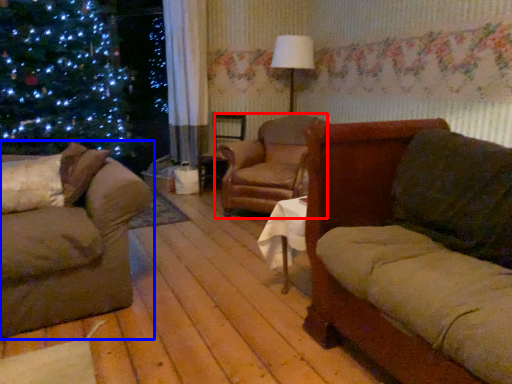
Question: Among these objects, which one is nearest to the camera, chair (highlighted by a red box) or studio couch (highlighted by a blue box)?

Choices:
 (A) chair
 (B) studio couch

Answer: (B)